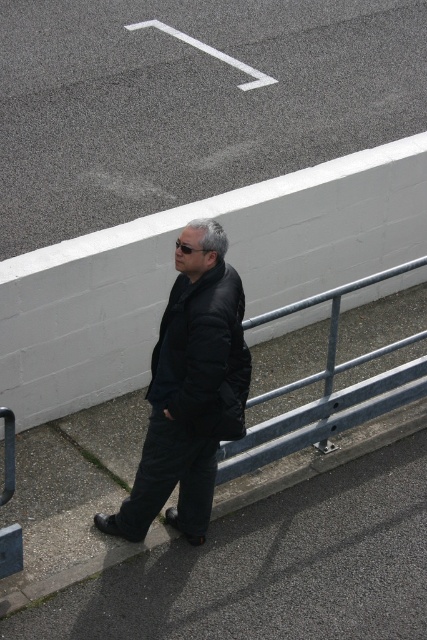
You are a delivery robot with a 36 inch wide package. You need to move from the gray asphalt at lower center to the black matte jacket at center. Can you fit through the space between them?

The gray asphalt at lower center and black matte jacket at center are 36.84 inches apart. Since the package is 36 inches wide, there is enough space for the robot to pass through the 36.84 inch gap between them.

You are standing at the point closer to the viewer between the two points, point (149,628) and point (224,371). Which direction should you walk to reach the person walking away from the camera?

Since point (149,628) is closer to the viewer, you are at that point. The person is walking towards the left side of the frame. To reach them, walk in the same direction they are moving, which is towards the left.

From the picture: You are a pedestrian trying to determine which jacket is taller between the black matte jacket at center and the black puffy jacket at center. Which one is taller?

The black matte jacket at center is taller than the black puffy jacket at center.